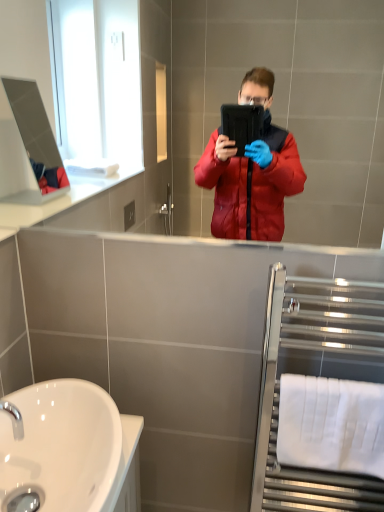
Describe the element at coordinates (61, 446) in the screenshot. I see `white glossy sink at lower left` at that location.

What do you see at coordinates (14, 418) in the screenshot? I see `chrome metallic tap at lower left` at bounding box center [14, 418].

This screenshot has width=384, height=512. Identify the location of white fabric towel bar at lower right. (331, 425).

Identify the location of white glossy sink at lower left. Image resolution: width=384 pixels, height=512 pixels. (61, 446).

Between polished chrome towel rack at right and white fabric towel bar at lower right, which one has larger width?

Wider between the two is polished chrome towel rack at right.

Is polished chrome towel rack at right facing towards white fabric towel bar at lower right?

Yes, polished chrome towel rack at right is aimed at white fabric towel bar at lower right.

Is polished chrome towel rack at right closer to camera compared to white fabric towel bar at lower right?

Yes, polished chrome towel rack at right is in front of white fabric towel bar at lower right.

From a real-world perspective, is polished chrome towel rack at right on white fabric towel bar at lower right?

Yes.

From the image's perspective, does polished chrome towel rack at right appear lower than white glossy sink at lower left?

No, from the image's perspective, polished chrome towel rack at right is not beneath white glossy sink at lower left.

Is polished chrome towel rack at right facing away from white glossy sink at lower left?

No, white glossy sink at lower left is not at the back of polished chrome towel rack at right.

Choose the correct answer: Is polished chrome towel rack at right inside white glossy sink at lower left or outside it?

polished chrome towel rack at right is outside white glossy sink at lower left.

From the picture: Is chrome metallic tap at lower left shorter than polished chrome towel rack at right?

Yes.

Is chrome metallic tap at lower left positioned behind polished chrome towel rack at right?

No, chrome metallic tap at lower left is closer to the camera.

Is chrome metallic tap at lower left wider than polished chrome towel rack at right?

Correct, the width of chrome metallic tap at lower left exceeds that of polished chrome towel rack at right.

How far apart are white glossy sink at lower left and polished chrome towel rack at right?

white glossy sink at lower left and polished chrome towel rack at right are 22.69 inches apart from each other.

Is white glossy sink at lower left looking in the opposite direction of polished chrome towel rack at right?

white glossy sink at lower left is not turned away from polished chrome towel rack at right.

Locate an element on the screen. The image size is (384, 512). balustrade on the right of white glossy sink at lower left is located at coordinates (315, 375).

From the image's perspective, is white glossy sink at lower left under polished chrome towel rack at right?

Yes.

Who is shorter, chrome metallic tap at lower left or white glossy sink at lower left?

With less height is chrome metallic tap at lower left.

What's the angular difference between chrome metallic tap at lower left and white glossy sink at lower left's facing directions?

The angle between the facing direction of chrome metallic tap at lower left and the facing direction of white glossy sink at lower left is 1.81 degrees.

Identify the location of tap above the white glossy sink at lower left (from a real-world perspective). The width and height of the screenshot is (384, 512). (14, 418).

Is chrome metallic tap at lower left to the right of white glossy sink at lower left from the viewer's perspective?

No, chrome metallic tap at lower left is not to the right of white glossy sink at lower left.

From the image's perspective, which object appears higher, white fabric towel bar at lower right or polished chrome towel rack at right?

From the image's view, polished chrome towel rack at right is above.

Is white fabric towel bar at lower right not inside polished chrome towel rack at right?

No, white fabric towel bar at lower right is not entirely external to polished chrome towel rack at right.

Is point (343, 394) positioned after point (330, 324)?

No, (343, 394) is closer to viewer.

Is white fabric towel bar at lower right taller than chrome metallic tap at lower left?

Correct, white fabric towel bar at lower right is much taller as chrome metallic tap at lower left.

Considering the sizes of objects white fabric towel bar at lower right and chrome metallic tap at lower left in the image provided, who is bigger, white fabric towel bar at lower right or chrome metallic tap at lower left?

With larger size is white fabric towel bar at lower right.

From the picture: Are white fabric towel bar at lower right and chrome metallic tap at lower left located far from each other?

They are positioned close to each other.

Between white fabric towel bar at lower right and chrome metallic tap at lower left, which one appears on the right side from the viewer's perspective?

Positioned to the right is white fabric towel bar at lower right.

The width and height of the screenshot is (384, 512). I want to click on towel bar behind the polished chrome towel rack at right, so click(331, 425).

This screenshot has height=512, width=384. I want to click on sink above the polished chrome towel rack at right (from a real-world perspective), so click(x=61, y=446).

When comparing their distances from white glossy sink at lower left, does polished chrome towel rack at right or chrome metallic tap at lower left seem further?

polished chrome towel rack at right lies further to white glossy sink at lower left than the other object.

Which object lies further to the anchor point white glossy sink at lower left, white fabric towel bar at lower right or chrome metallic tap at lower left?

Based on the image, white fabric towel bar at lower right appears to be further to white glossy sink at lower left.

Which object lies further to the anchor point white fabric towel bar at lower right, chrome metallic tap at lower left or polished chrome towel rack at right?

chrome metallic tap at lower left is positioned further to the anchor white fabric towel bar at lower right.

Looking at the image, which one is located further to polished chrome towel rack at right, chrome metallic tap at lower left or white fabric towel bar at lower right?

chrome metallic tap at lower left is positioned further to the anchor polished chrome towel rack at right.

From the image, which object appears to be nearer to polished chrome towel rack at right, white fabric towel bar at lower right or white glossy sink at lower left?

Among the two, white fabric towel bar at lower right is located nearer to polished chrome towel rack at right.

Looking at the image, which one is located closer to polished chrome towel rack at right, white glossy sink at lower left or white fabric towel bar at lower right?

white fabric towel bar at lower right is positioned closer to the anchor polished chrome towel rack at right.

From the picture: From the image, which object appears to be nearer to white fabric towel bar at lower right, white glossy sink at lower left or polished chrome towel rack at right?

Based on the image, polished chrome towel rack at right appears to be nearer to white fabric towel bar at lower right.

Based on their spatial positions, is white glossy sink at lower left or white fabric towel bar at lower right closer to chrome metallic tap at lower left?

white glossy sink at lower left lies closer to chrome metallic tap at lower left than the other object.

Identify the location of towel bar between chrome metallic tap at lower left and polished chrome towel rack at right in the horizontal direction. (331, 425).

Where is `towel bar between white glossy sink at lower left and polished chrome towel rack at right in the horizontal direction`? The width and height of the screenshot is (384, 512). towel bar between white glossy sink at lower left and polished chrome towel rack at right in the horizontal direction is located at coordinates (331, 425).

At what (x,y) coordinates should I click in order to perform the action: click on sink between chrome metallic tap at lower left and white fabric towel bar at lower right from left to right. Please return your answer as a coordinate pair (x, y). This screenshot has height=512, width=384. Looking at the image, I should click on (61, 446).

Identify the location of sink situated between chrome metallic tap at lower left and polished chrome towel rack at right from left to right. The height and width of the screenshot is (512, 384). click(x=61, y=446).